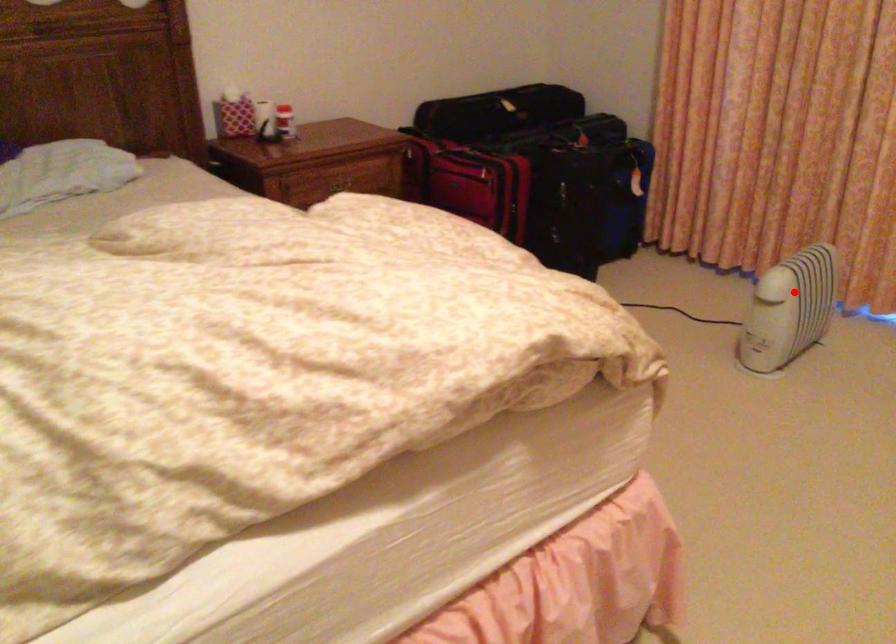
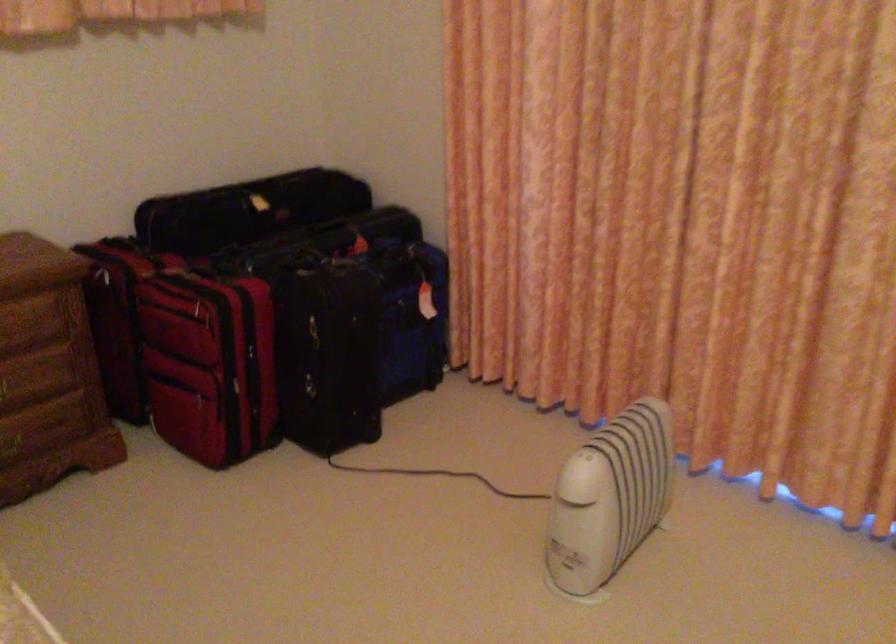
The point at the highlighted location is marked in the first image. Where is the corresponding point in the second image?

(609, 498)